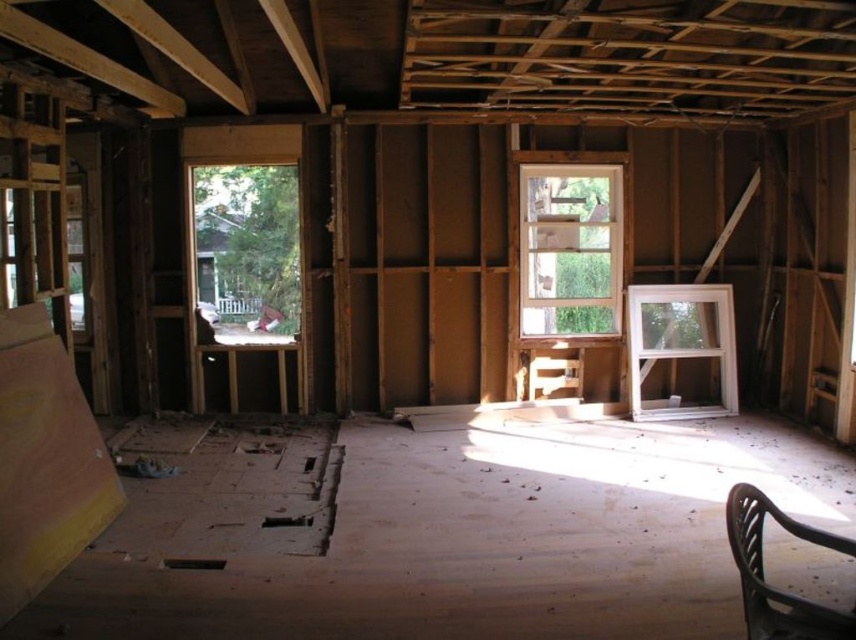
You are an inspector checking the windows in a construction site. You see the clear glass window at center and the white plastic window at right. Which window has a larger size?

The white plastic window at right is larger than the clear glass window at center.

You are a contractor inspecting the construction site. You notice the clear glass window at center and the white plastic window at right. Which window is positioned higher in the room?

The clear glass window at center is located above the white plastic window at right, meaning it is positioned higher in the room.

You are standing in the middle of the room and want to look outside through the windows. Which window, the clear glass window at center or the white plastic window at right, would allow you to see the outside more clearly?

The clear glass window at center allows you to see the outside more clearly because it is in front of the white plastic window at right.